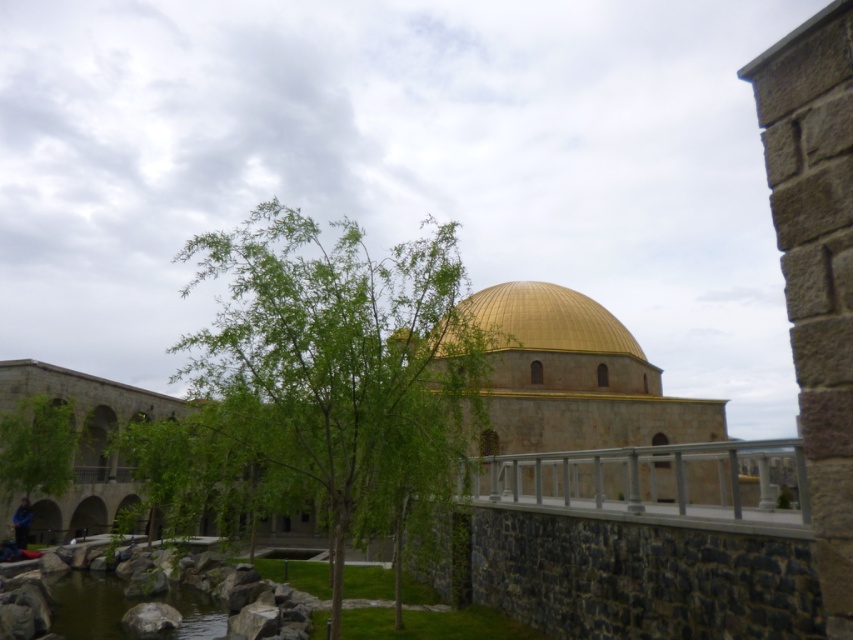
Question: Can you confirm if green water at lower left is positioned to the right of blue fabric jacket at lower left?

Choices:
 (A) yes
 (B) no

Answer: (A)

Question: Is gold polished dome at center further to the viewer compared to blue fabric jacket at lower left?

Choices:
 (A) yes
 (B) no

Answer: (A)

Question: Which object is the closest to the gold polished dome at center?

Choices:
 (A) green leafy tree at center
 (B) green water at lower left
 (C) green leafy tree at lower left
 (D) blue fabric jacket at lower left

Answer: (A)

Question: Estimate the real-world distances between objects in this image. Which object is closer to the blue fabric jacket at lower left?

Choices:
 (A) green leafy tree at center
 (B) green leafy tree at lower left

Answer: (B)

Question: Which object is closer to the camera taking this photo?

Choices:
 (A) green water at lower left
 (B) blue fabric jacket at lower left
 (C) gold polished dome at center

Answer: (A)

Question: Is gold polished dome at center bigger than blue fabric jacket at lower left?

Choices:
 (A) yes
 (B) no

Answer: (A)